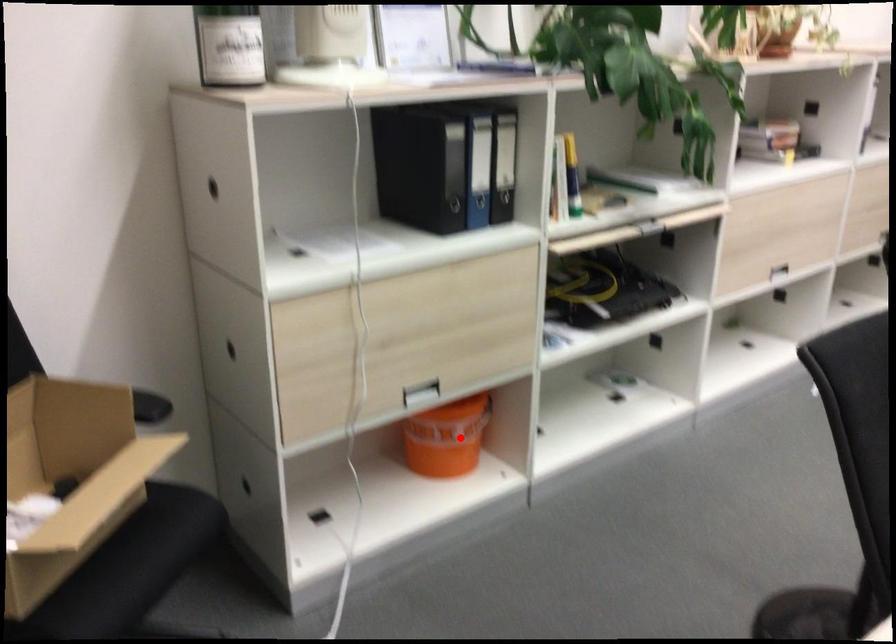
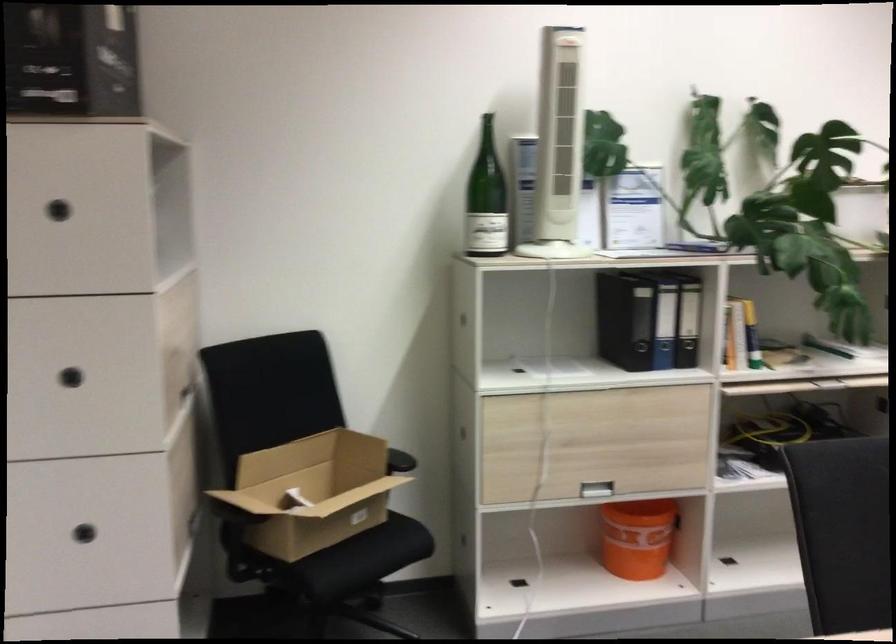
Question: A red point is marked in image1. In image2, is the corresponding 3D point closer to the camera or farther? Reply with the corresponding letter.

Choices:
 (A) The corresponding 3D point is closer.
 (B) The corresponding 3D point is farther.

Answer: (B)